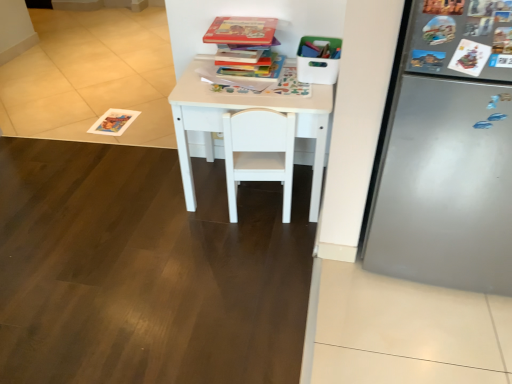
Question: From a real-world perspective, is hardcover book at upper center, the 1th book positioned from the top, physically below hardcover book at upper center, which appears as the 2th book when ordered from the bottom?

Choices:
 (A) no
 (B) yes

Answer: (A)

Question: Is hardcover book at upper center, the 3th book ordered from the bottom, taller than hardcover book at upper center, which appears as the 2th book when ordered from the bottom?

Choices:
 (A) yes
 (B) no

Answer: (B)

Question: From a real-world perspective, is hardcover book at upper center, the 1th book positioned from the top, on top of hardcover book at upper center, which appears as the 2th book when ordered from the bottom?

Choices:
 (A) no
 (B) yes

Answer: (B)

Question: Does hardcover book at upper center, the 3th book ordered from the bottom, have a greater width compared to hardcover book at upper center, which appears as the 2th book when ordered from the bottom?

Choices:
 (A) no
 (B) yes

Answer: (B)

Question: Is hardcover book at upper center, the 3th book ordered from the bottom, facing towards hardcover book at upper center, the second book viewed from the top?

Choices:
 (A) no
 (B) yes

Answer: (A)

Question: Considering the positions of hardcover book at upper center, which appears as the 2th book when ordered from the bottom, and white matte table at center in the image, is hardcover book at upper center, which appears as the 2th book when ordered from the bottom, wider or thinner than white matte table at center?

Choices:
 (A) wide
 (B) thin

Answer: (B)

Question: In terms of height, does hardcover book at upper center, which appears as the 2th book when ordered from the bottom, look taller or shorter compared to white matte table at center?

Choices:
 (A) short
 (B) tall

Answer: (A)

Question: Is hardcover book at upper center, the second book viewed from the top, in front of or behind white matte table at center in the image?

Choices:
 (A) behind
 (B) front

Answer: (A)

Question: In the image, is hardcover book at upper center, which appears as the 2th book when ordered from the bottom, on the left side or the right side of white matte table at center?

Choices:
 (A) right
 (B) left

Answer: (B)

Question: From the image's perspective, relative to hardcover book at upper center, the 3th book ordered from the bottom, is white matte table at center above or below?

Choices:
 (A) above
 (B) below

Answer: (B)

Question: From a real-world perspective, is white matte table at center positioned above or below hardcover book at upper center, the 3th book ordered from the bottom?

Choices:
 (A) above
 (B) below

Answer: (B)

Question: In the image, is white matte table at center positioned in front of or behind hardcover book at upper center, the 3th book ordered from the bottom?

Choices:
 (A) front
 (B) behind

Answer: (A)

Question: Considering the positions of point (314, 185) and point (272, 41), is point (314, 185) closer or farther from the camera than point (272, 41)?

Choices:
 (A) farther
 (B) closer

Answer: (A)

Question: Is white matte table at center inside or outside of white matte chair at center?

Choices:
 (A) outside
 (B) inside

Answer: (A)

Question: From their relative heights in the image, would you say white matte table at center is taller or shorter than white matte chair at center?

Choices:
 (A) tall
 (B) short

Answer: (A)